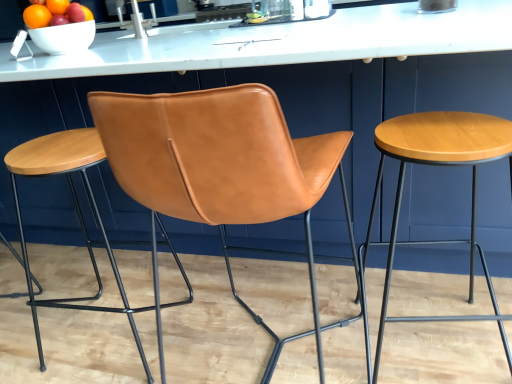
The height and width of the screenshot is (384, 512). Identify the location of free space to the right of white glossy bowl at upper left. (120, 43).